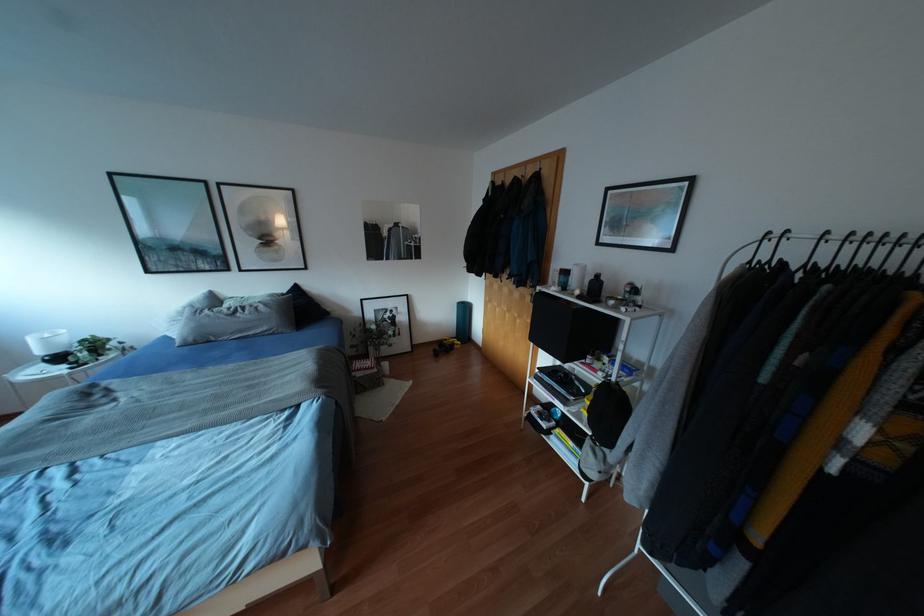
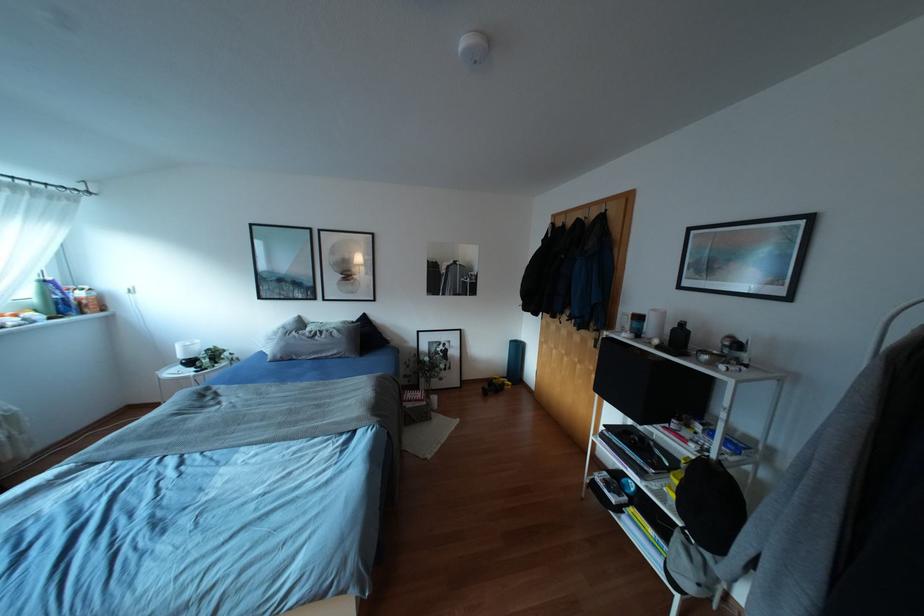
Where in the second image is the point corresponding to point (237, 314) from the first image?

(315, 338)